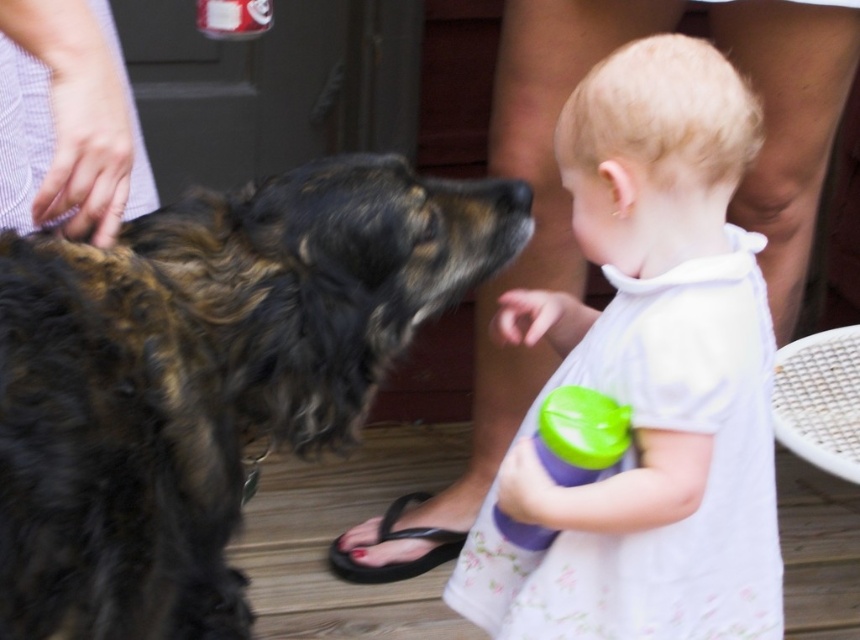
You are a photographer trying to capture a closeup of the white floral dress at center and the black rubber sandal at lower center. Since you can only focus on one object at a time, which one should you focus on first if you want to ensure the other is in the background?

You should focus on the white floral dress at center first because it is located above the black rubber sandal at lower center, meaning the sandal is further away and would be in the background if the dress is in focus.

You are a photographer trying to frame a shot of the white floral dress at center and the green plastic sippy cup at lower center. If you want to ensure both are visible in the frame, which object should you adjust your focus on to accommodate their sizes?

The white floral dress at center is wider than the green plastic sippy cup at lower center, so you should focus on the white floral dress at center to ensure it fits within the frame.